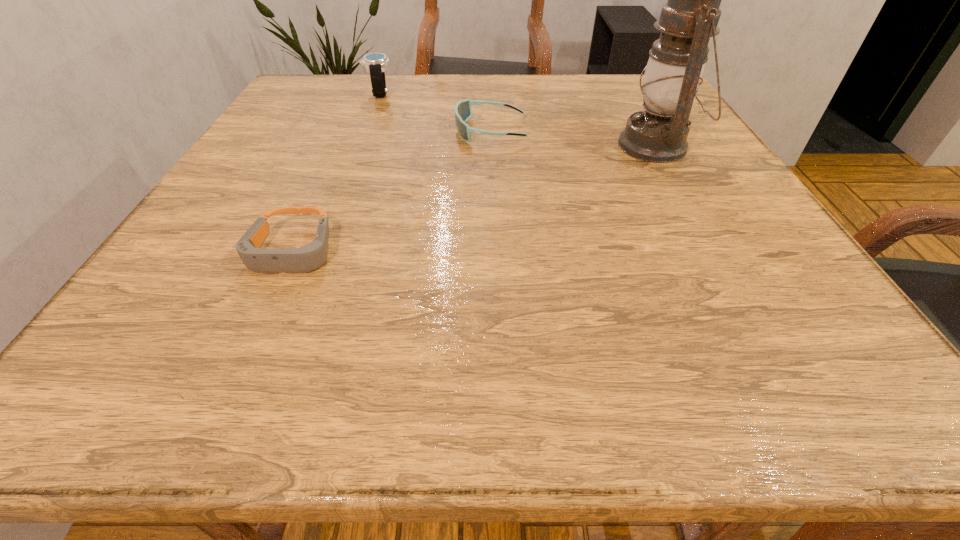
The width and height of the screenshot is (960, 540). Find the location of `oil lamp`. oil lamp is located at coordinates (658, 134).

Locate an element on the screen. This screenshot has height=540, width=960. the tallest object is located at coordinates (658, 134).

Where is `watch`? watch is located at coordinates (375, 63).

Locate an element on the screen. This screenshot has height=540, width=960. the third shortest object is located at coordinates (375, 63).

Where is `the third object from left to right`? The image size is (960, 540). the third object from left to right is located at coordinates (463, 111).

This screenshot has height=540, width=960. Find the location of `the right goggles`. the right goggles is located at coordinates (463, 111).

I want to click on the left goggles, so click(311, 256).

The width and height of the screenshot is (960, 540). Find the location of `the nearer goggles`. the nearer goggles is located at coordinates (311, 256).

This screenshot has width=960, height=540. I want to click on vacant point located 0.160m on the left of the tallest object, so click(x=543, y=146).

Where is `vacant area located on the front of the third shortest object`? This screenshot has height=540, width=960. vacant area located on the front of the third shortest object is located at coordinates (356, 154).